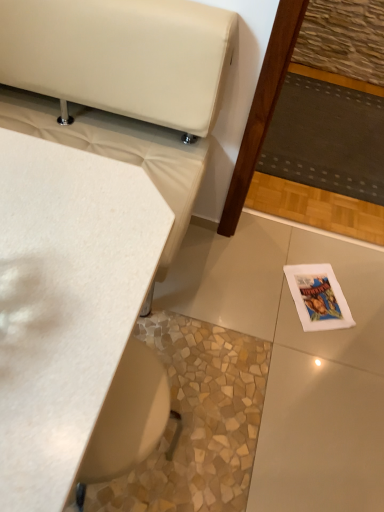
Find the location of `free spot above white matte table at upper left (from a real-world perspective)`. free spot above white matte table at upper left (from a real-world perspective) is located at coordinates coord(54,248).